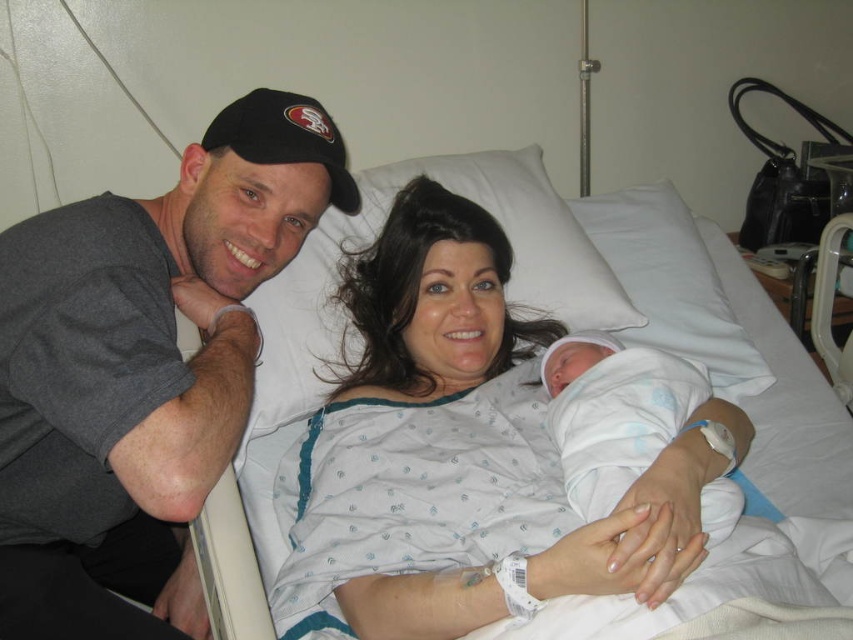
Between gray cotton t-shirt at upper left and white cotton hospital gown at center, which one appears on the left side from the viewer's perspective?

gray cotton t-shirt at upper left

Who is shorter, gray cotton t-shirt at upper left or white cotton hospital gown at center?

white cotton hospital gown at center

Is point (0, 353) closer to viewer compared to point (405, 387)?

Yes, it is in front of point (405, 387).

At what (x,y) coordinates should I click in order to perform the action: click on gray cotton t-shirt at upper left. Please return your answer as a coordinate pair (x, y). Looking at the image, I should click on (141, 369).

Can you confirm if gray cotton t-shirt at upper left is taller than white soft swaddled newborn at center?

Yes, gray cotton t-shirt at upper left is taller than white soft swaddled newborn at center.

Does point (187, 611) come in front of point (612, 449)?

No.

Does point (107, 426) come closer to viewer compared to point (618, 433)?

Yes.

Image resolution: width=853 pixels, height=640 pixels. In order to click on gray cotton t-shirt at upper left in this screenshot , I will do [x=141, y=369].

Is white cotton hospital gown at center to the right of white soft swaddled newborn at center from the viewer's perspective?

In fact, white cotton hospital gown at center is to the left of white soft swaddled newborn at center.

Which is more to the right, white cotton hospital gown at center or white soft swaddled newborn at center?

white soft swaddled newborn at center

The height and width of the screenshot is (640, 853). What are the coordinates of `white cotton hospital gown at center` in the screenshot? It's located at (459, 456).